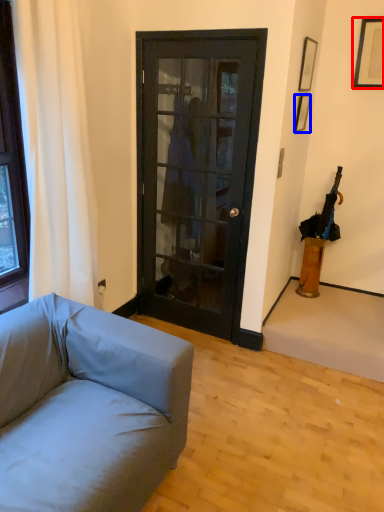
Question: Which of the following is the farthest to the observer, picture frame (highlighted by a red box) or picture frame (highlighted by a blue box)?

Choices:
 (A) picture frame
 (B) picture frame

Answer: (A)